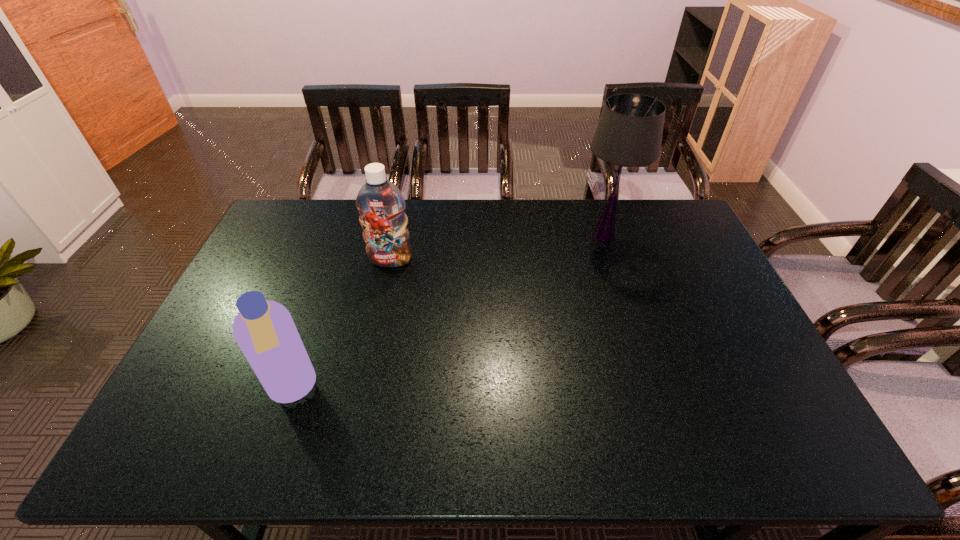
In order to click on the rightmost object in this screenshot , I will do `click(629, 132)`.

Locate an element on the screen. Image resolution: width=960 pixels, height=540 pixels. lampshade is located at coordinates (629, 132).

Locate an element on the screen. the second object from right to left is located at coordinates (380, 203).

Where is `the right shampoo`? the right shampoo is located at coordinates (380, 203).

Image resolution: width=960 pixels, height=540 pixels. In order to click on the nearest object in this screenshot , I will do click(x=264, y=330).

Where is `the leftmost object`? The image size is (960, 540). the leftmost object is located at coordinates (264, 330).

Find the location of a particular element. The image size is (960, 540). free space located 0.360m on the front-facing side of the lampshade is located at coordinates (473, 235).

At what (x,y) coordinates should I click in order to perform the action: click on vacant point located 0.120m on the front-facing side of the lampshade. Please return your answer as a coordinate pair (x, y). Image resolution: width=960 pixels, height=540 pixels. Looking at the image, I should click on (541, 235).

Identify the location of free point located 0.140m on the front-facing side of the lampshade. The image size is (960, 540). (536, 235).

Find the location of a particular element. This screenshot has width=960, height=540. vacant point located 0.150m on the front label of the farther shampoo is located at coordinates (382, 302).